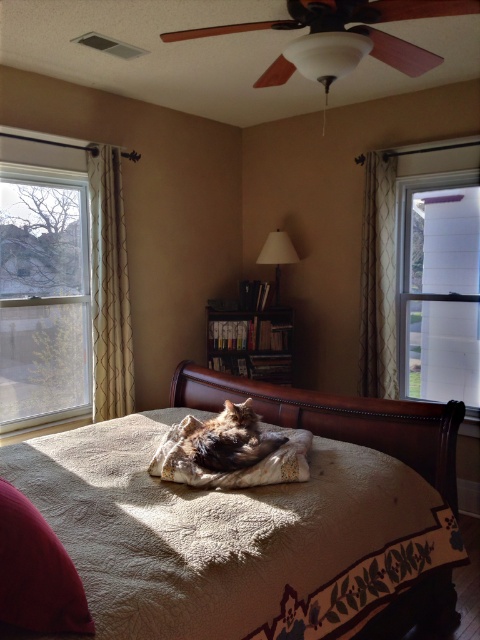
Question: Does brown wooden bookshelf at center lie behind fluffy beige blanket at center?

Choices:
 (A) no
 (B) yes

Answer: (B)

Question: Does clear glass window at right have a larger size compared to matte white lampshade at upper center?

Choices:
 (A) yes
 (B) no

Answer: (A)

Question: Which object is the closest to the brown wooden bookshelf at center?

Choices:
 (A) velvety red pillow at lower left
 (B) clear glass window at right
 (C) beige textured curtain at left
 (D) beige quilted bed at center

Answer: (C)

Question: Estimate the real-world distances between objects in this image. Which object is farther from the beige textured curtain at right?

Choices:
 (A) fluffy beige blanket at center
 (B) beige textured curtain at left
 (C) brown wooden bookshelf at center
 (D) matte white lampshade at upper center

Answer: (A)

Question: Among these objects, which one is nearest to the camera?

Choices:
 (A) clear glass window at right
 (B) beige textured curtain at left
 (C) matte white lampshade at upper center

Answer: (A)

Question: Is clear glass window at left bigger than fluffy beige blanket at center?

Choices:
 (A) yes
 (B) no

Answer: (A)